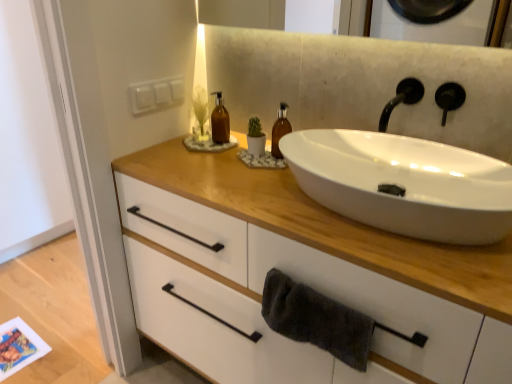
What are the coordinates of `free region on the left part of brown glass bottle at center, acting as the second bottle starting from the right` in the screenshot? It's located at (161, 153).